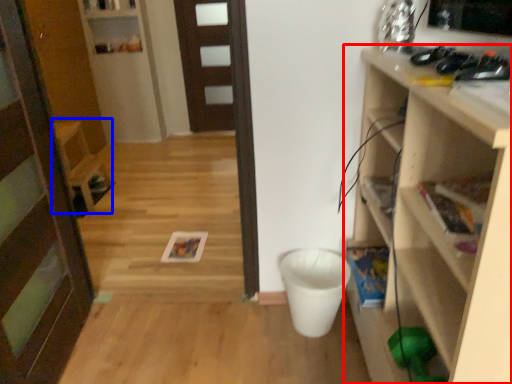
Question: Which point is closer to the camera, shelf (highlighted by a red box) or chair (highlighted by a blue box)?

Choices:
 (A) shelf
 (B) chair

Answer: (A)